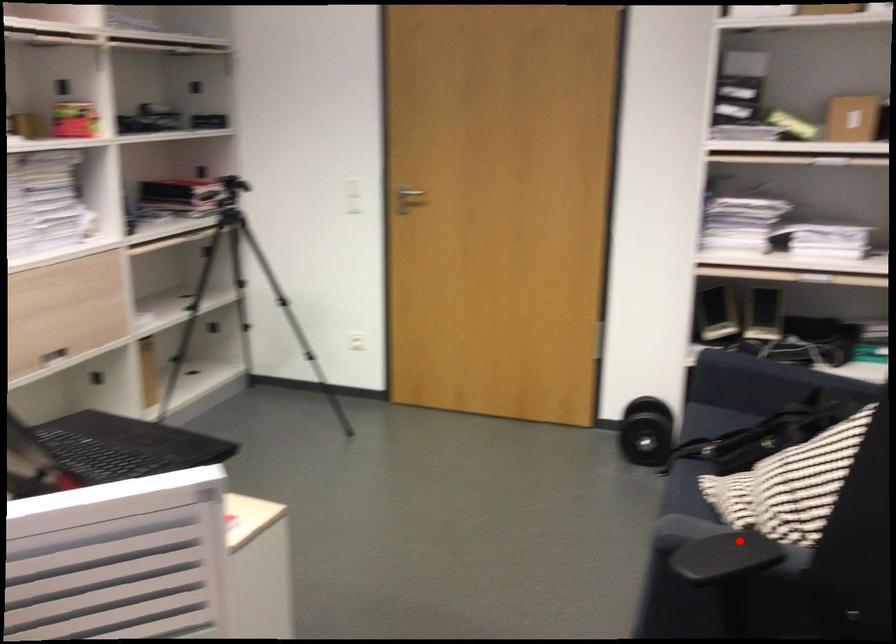
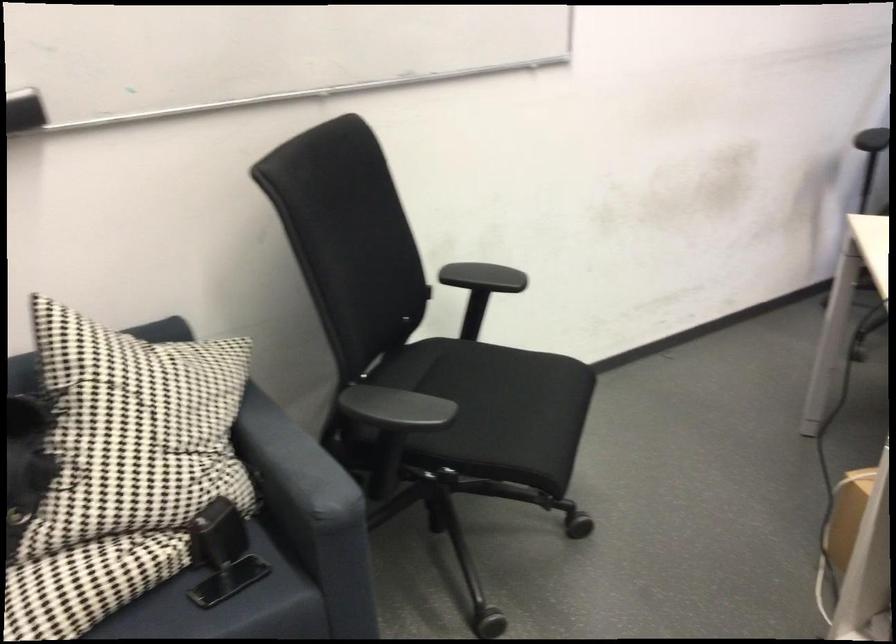
Where in the second image is the point corresponding to the highlighted location from the first image?

(293, 464)